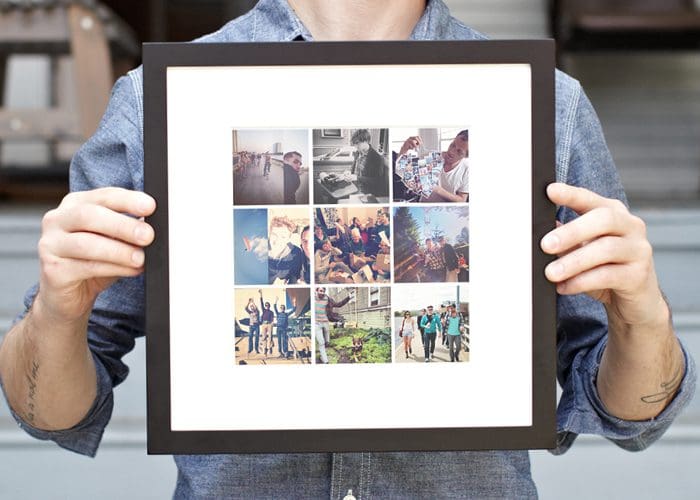
In order to click on photos in 3x3 collage in this screenshot , I will do `click(290, 168)`, `click(351, 168)`, `click(416, 169)`, `click(411, 213)`, `click(346, 235)`, `click(286, 228)`, `click(295, 320)`, `click(346, 320)`, `click(430, 332)`.